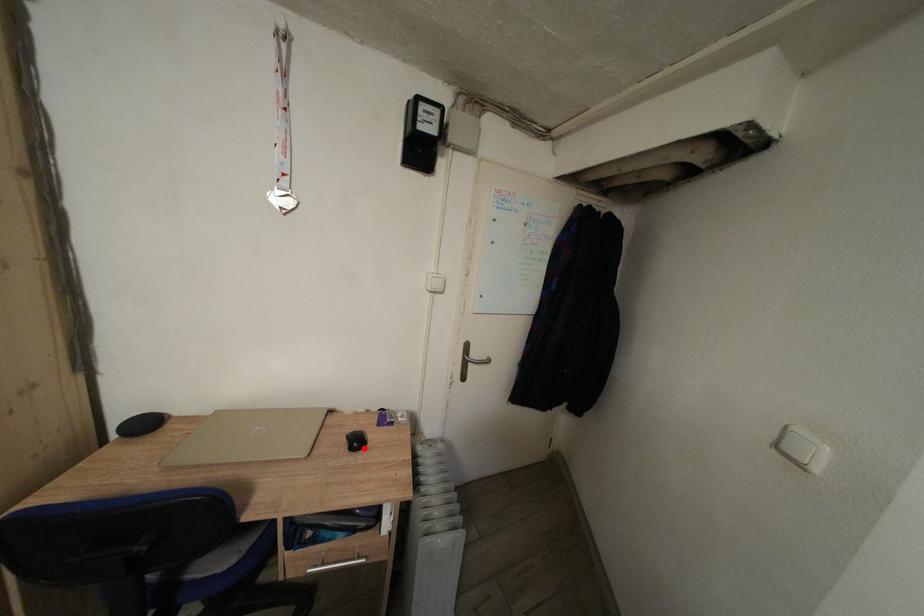
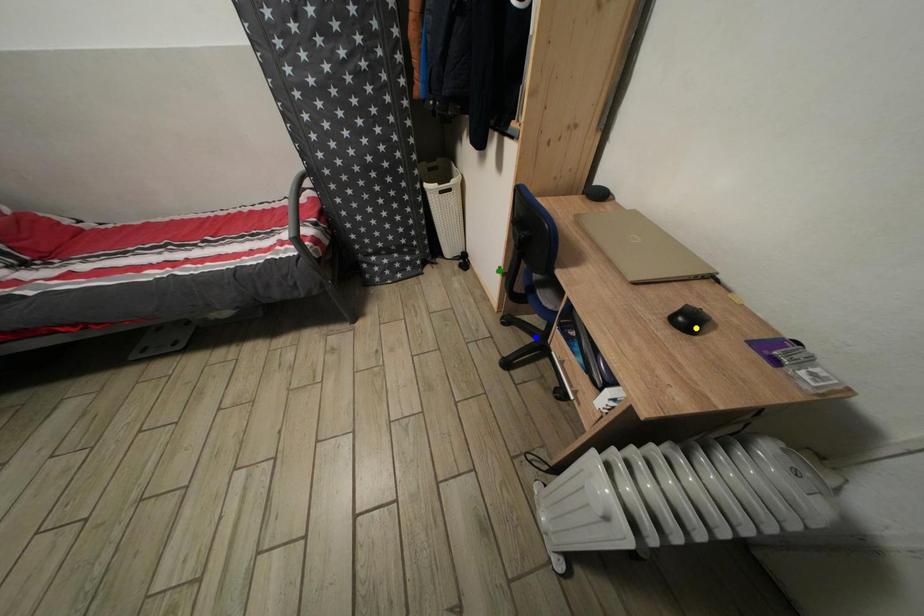
Question: I am providing you with two images of the same scene from different viewpoints. A red point is marked on the first image. You are given multiple points on the second image. Can you choose the point in image 2 that corresponds to the point in image 1?

Choices:
 (A) yellow point
 (B) blue point
 (C) green point

Answer: (A)